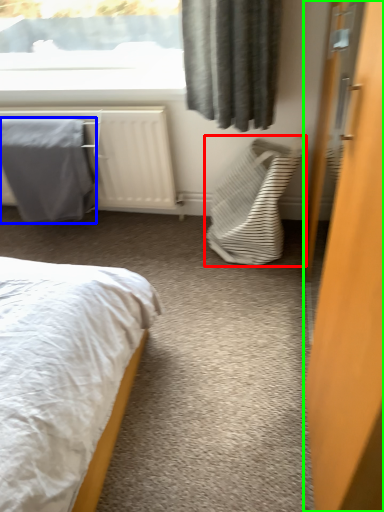
Question: Based on their relative distances, which object is farther from laundry basket (highlighted by a red box)? Choose from blanket (highlighted by a blue box) and door (highlighted by a green box).

Choices:
 (A) blanket
 (B) door

Answer: (B)